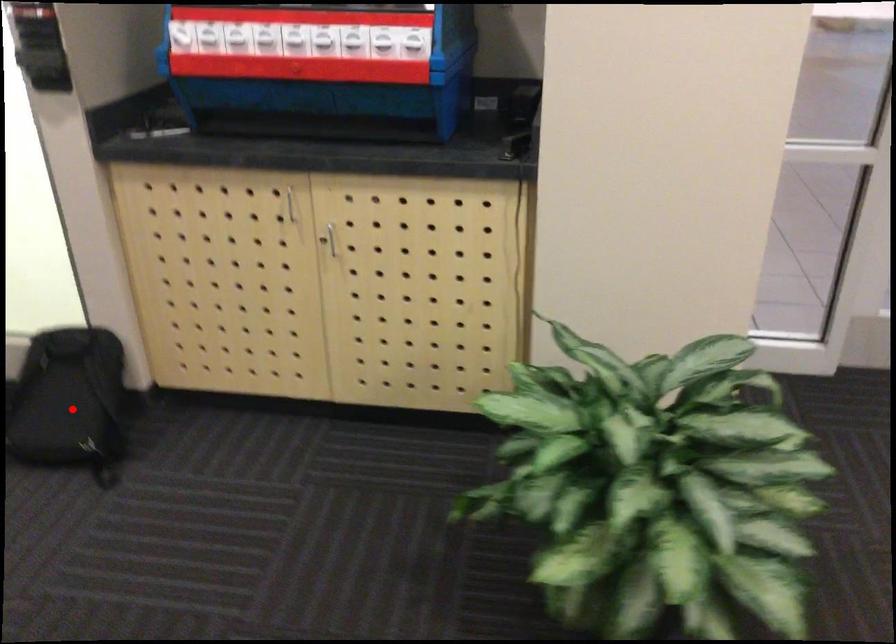
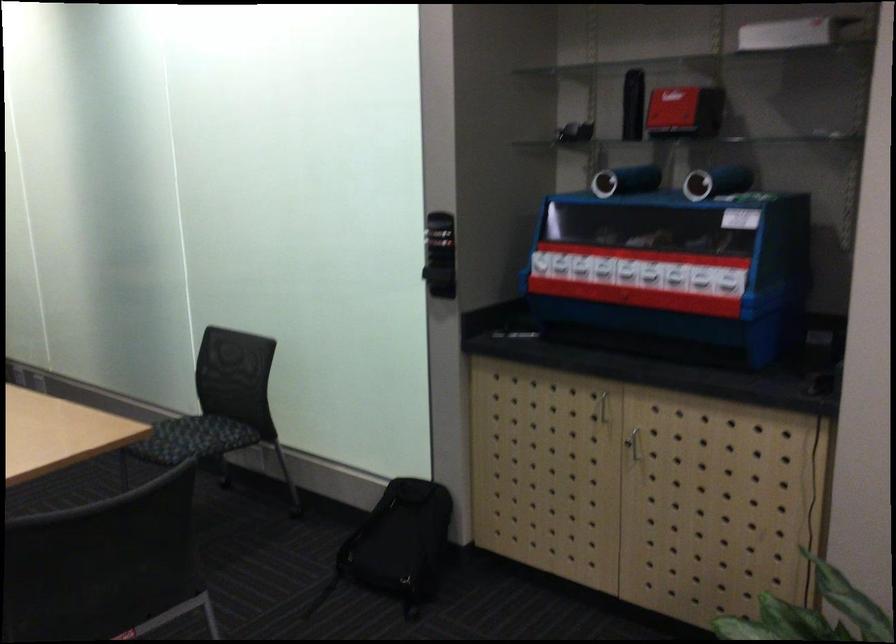
Question: I am providing you with two images of the same scene from different viewpoints. Image1 has a red point marked. In image2, the corresponding 3D location appears at what relative position? Reply with the corresponding letter.

Choices:
 (A) Closer
 (B) Farther

Answer: (B)